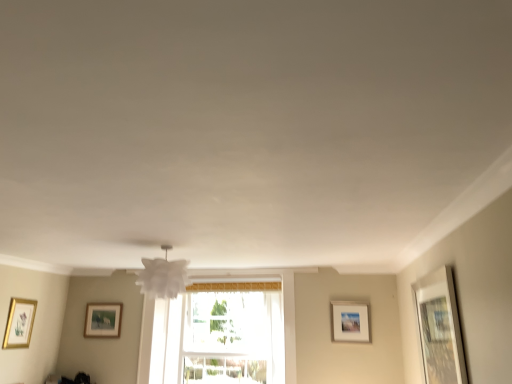
Question: Is wooden picture frame at right, which ranks as the 1th picture frame in front-to-back order, taller or shorter than gold-framed picture at left, the 1th picture frame in the left-to-right sequence?

Choices:
 (A) tall
 (B) short

Answer: (A)

Question: In terms of width, does wooden picture frame at right, placed as the fourth picture frame when sorted from left to right, look wider or thinner when compared to gold-framed picture at left, which appears as the second picture frame when viewed from the front?

Choices:
 (A) wide
 (B) thin

Answer: (A)

Question: Which object is the farthest from the matte wooden picture frame at lower left, which is the 4th picture frame in front-to-back order?

Choices:
 (A) white paper lampshade at center
 (B) gold-framed picture at left, which appears as the second picture frame when viewed from the front
 (C) transparent glass window at center
 (D) white matte picture frame at upper right, the second picture frame in the back-to-front sequence
 (E) wooden picture frame at right, placed as the fourth picture frame when sorted from left to right

Answer: (E)

Question: Estimate the real-world distances between objects in this image. Which object is closer to the white paper lampshade at center?

Choices:
 (A) wooden picture frame at right, placed as the fourth picture frame when sorted from left to right
 (B) matte wooden picture frame at lower left, which is the 4th picture frame in front-to-back order
 (C) gold-framed picture at left, the third picture frame viewed from the back
 (D) white matte picture frame at upper right, the second picture frame in the back-to-front sequence
 (E) transparent glass window at center

Answer: (E)